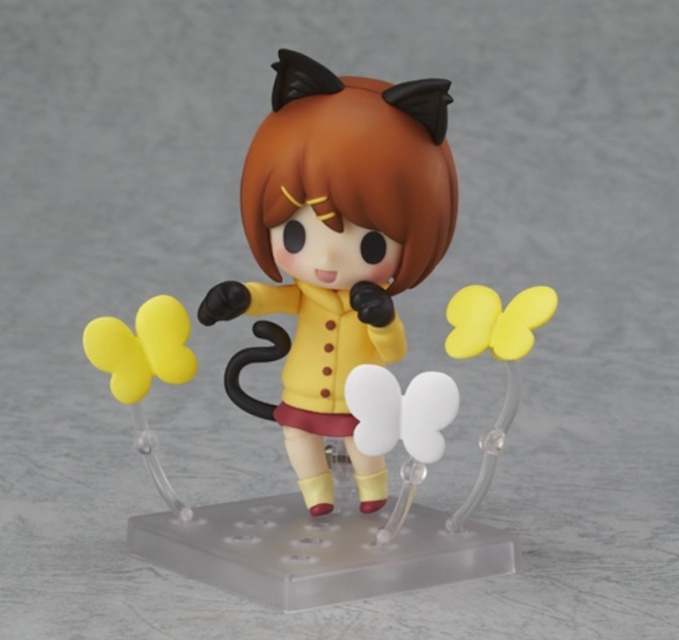
You are standing at the camera position and want to place a small sticker exactly at point [414,192]. If your arm can reach up to 1 meter, will you be able to reach that point?

The distance between point [414,192] and the camera is 1.08 meters, so your arm cannot reach it since it is longer than 1 meter.

You are a collector who wants to arrange the yellow matte figure at center and the yellow matte balloon at left in a straight line from left to right. Based on the scene, which object should come first in this arrangement?

The yellow matte balloon at left should come first in the arrangement because the yellow matte figure at center is positioned on the right side of it.

You are a collector who wants to place both the yellow matte figure at center and the matte yellow figure at center on a shelf that can only accommodate items spaced 3 centimeters apart. Based on the image, will they fit without overlapping?

The distance between the yellow matte figure at center and matte yellow figure at center is 2.75 centimeters, which is less than the 3 centimeter requirement. Therefore, they will fit without overlapping.